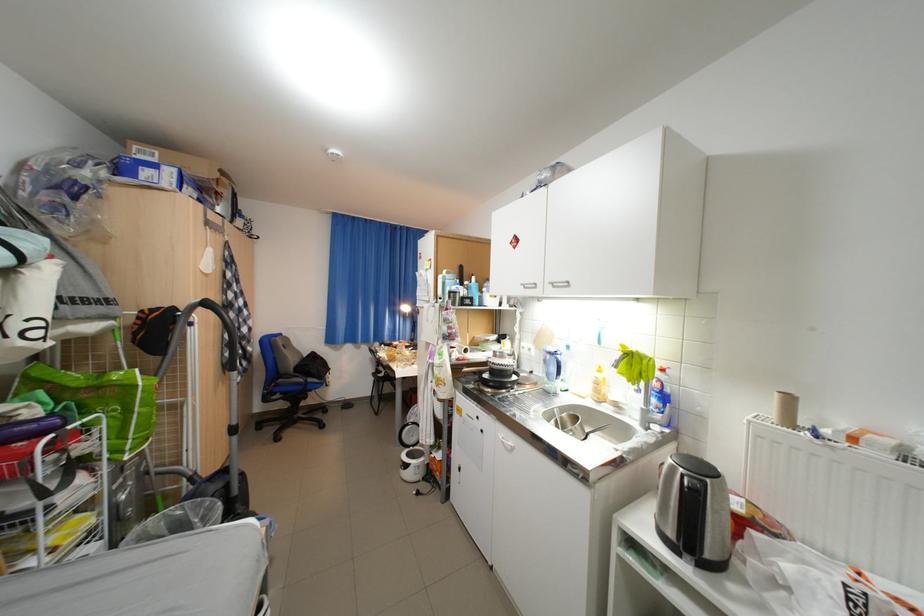
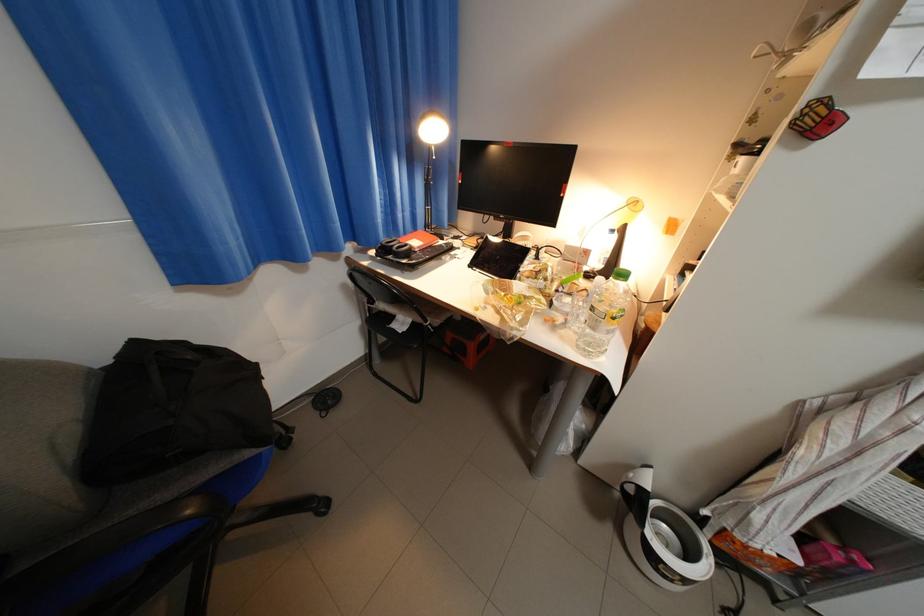
The point at (383, 359) is marked in the first image. Where is the corresponding point in the second image?

(355, 286)